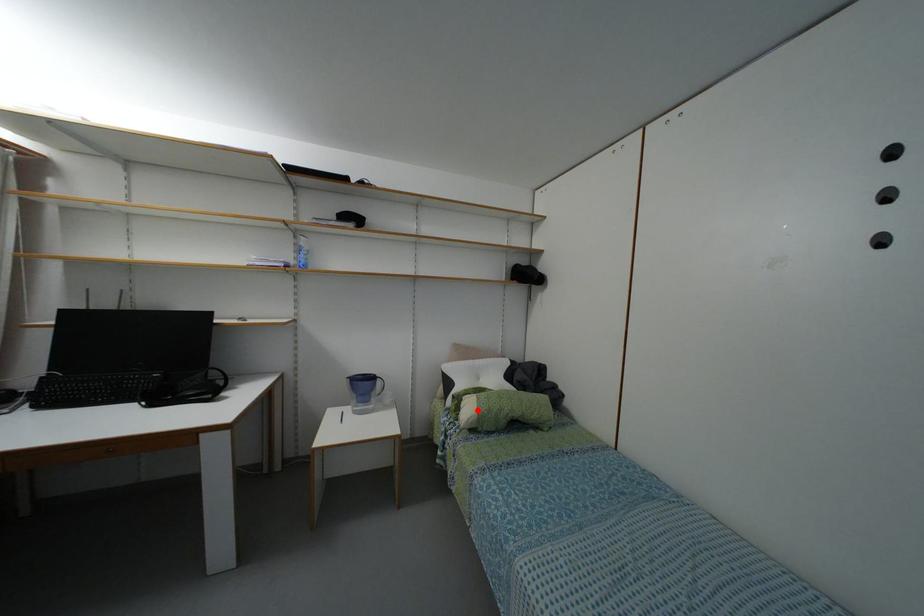
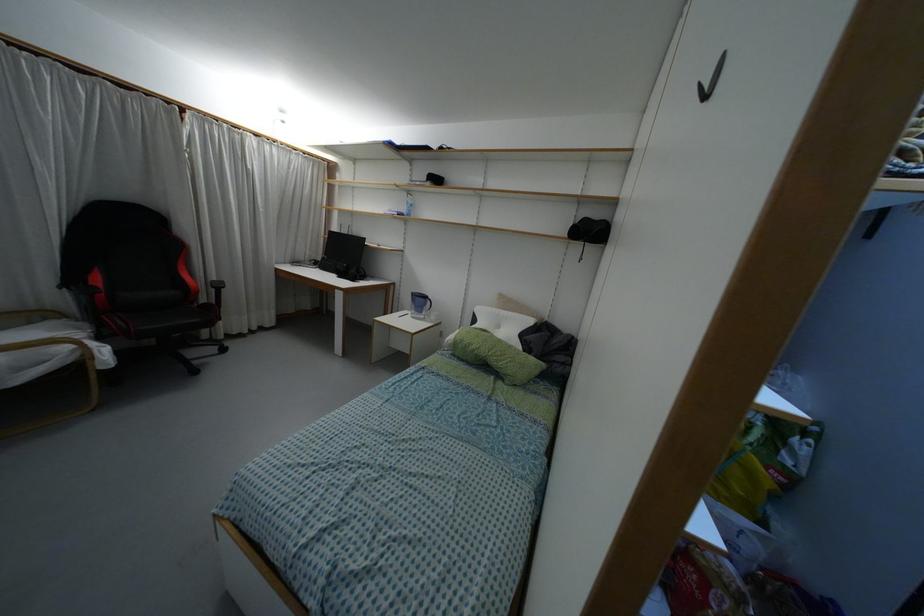
The point at the highlighted location is marked in the first image. Where is the corresponding point in the second image?

(455, 337)